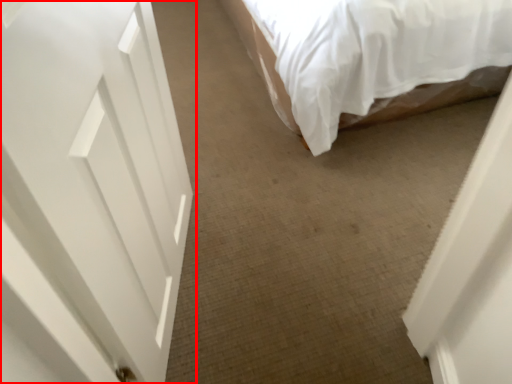
Question: Considering the relative positions of door (annotated by the red box) and bed in the image provided, where is door (annotated by the red box) located with respect to the staircase?

Choices:
 (A) right
 (B) left

Answer: (B)